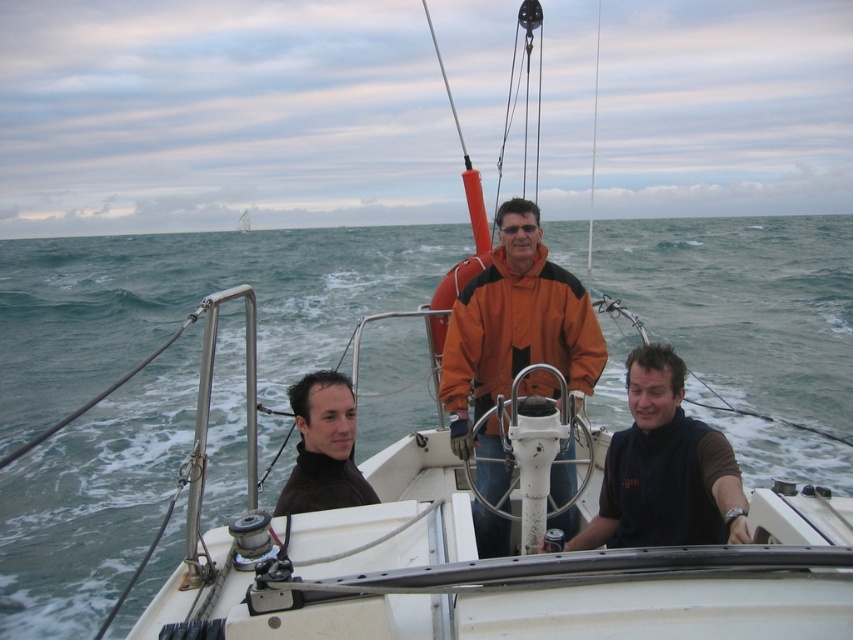
Is point (440, 372) behind point (287, 502)?

Yes, point (440, 372) is behind point (287, 502).

Who is higher up, orange matte jacket at center or dark brown leather jacket at left?

orange matte jacket at center is above.

Identify the location of orange matte jacket at center. (514, 337).

The width and height of the screenshot is (853, 640). I want to click on orange matte jacket at center, so click(514, 337).

Is green water at center positioned in front of dark brown fabric shirt at center?

That is False.

What do you see at coordinates (190, 300) in the screenshot?
I see `green water at center` at bounding box center [190, 300].

Where is `green water at center`? The image size is (853, 640). green water at center is located at coordinates (190, 300).

Which of these two, orange matte jacket at center or white fabric sail at upper center, stands shorter?

orange matte jacket at center is shorter.

Is point (578, 390) closer to camera compared to point (247, 216)?

Yes, it is.

Between point (560, 314) and point (244, 220), which one is positioned behind?

Positioned behind is point (244, 220).

The width and height of the screenshot is (853, 640). In order to click on orange matte jacket at center in this screenshot , I will do `click(514, 337)`.